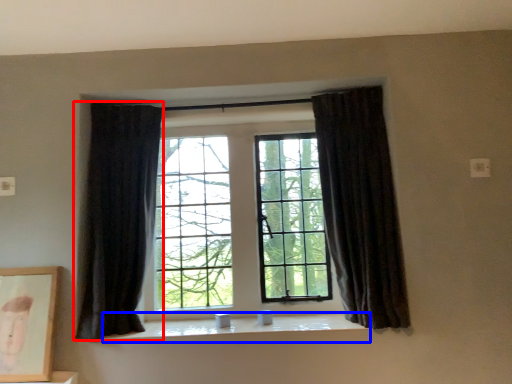
Question: Which object appears farthest to the camera in this image, curtain (highlighted by a red box) or window sill (highlighted by a blue box)?

Choices:
 (A) curtain
 (B) window sill

Answer: (B)